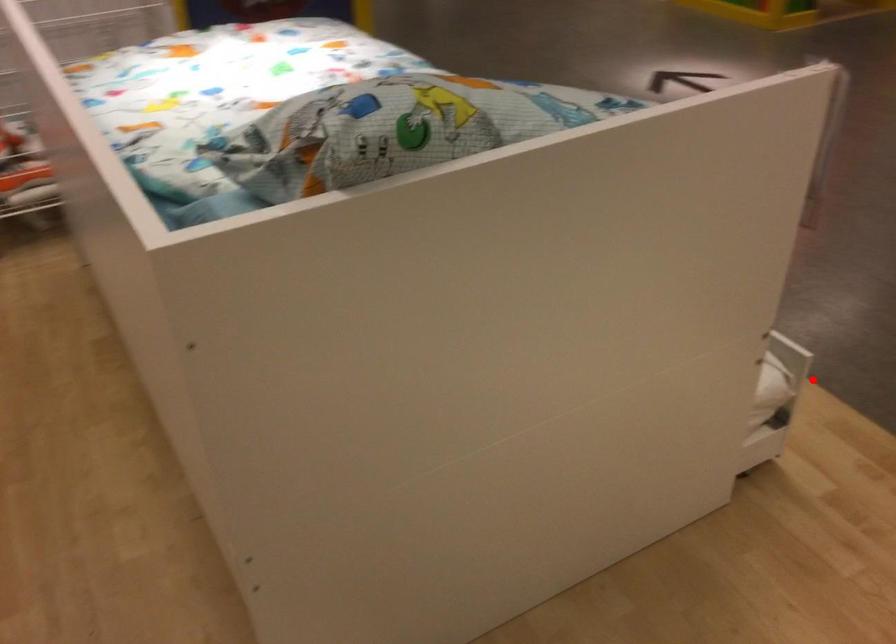
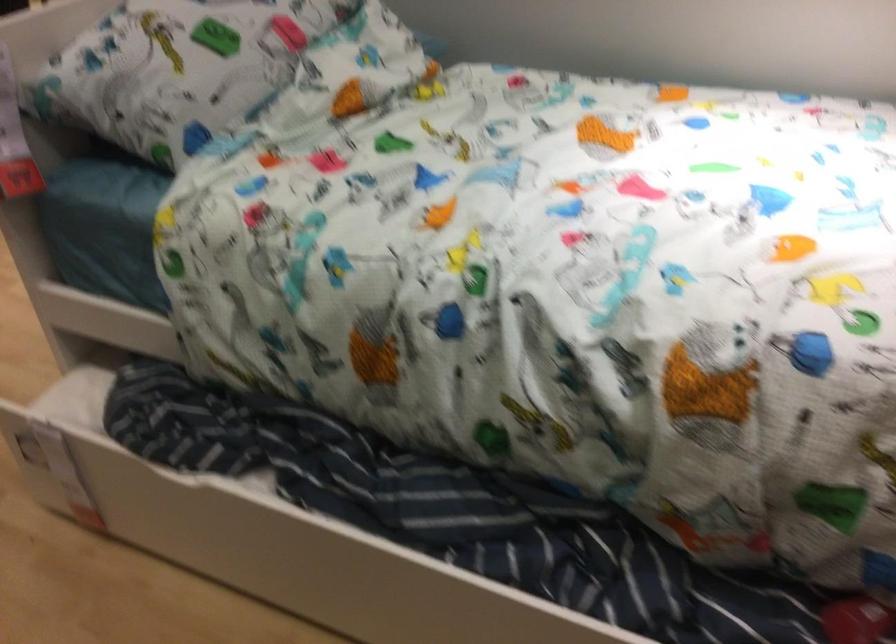
In the second image, find the point that corresponds to the highlighted location in the first image.

(24, 448)